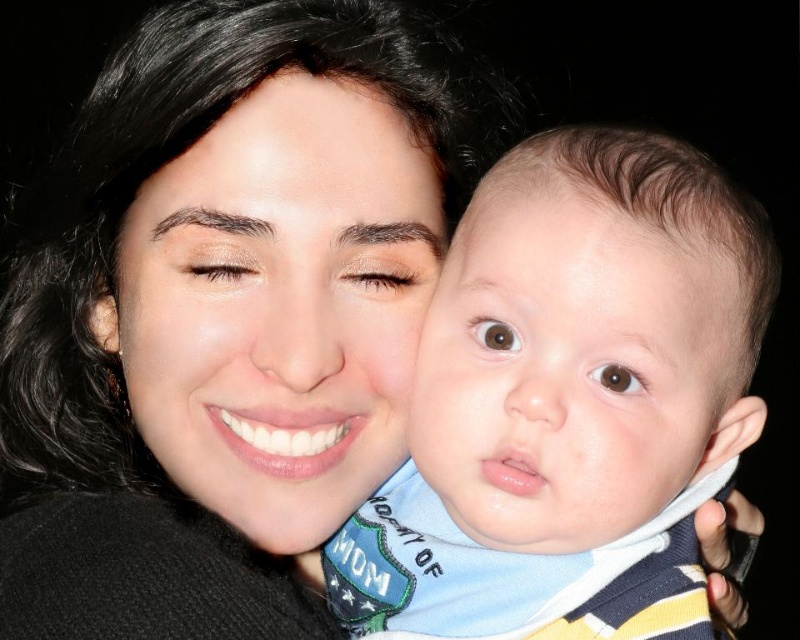
Question: Can you confirm if smooth skin baby at center is bigger than smooth skin at upper center?

Choices:
 (A) yes
 (B) no

Answer: (A)

Question: Which of the following is the farthest from the observer?

Choices:
 (A) soft blue bib at center
 (B) smooth skin baby at center
 (C) smooth skin face at center

Answer: (C)

Question: Among these points, which one is farthest from the camera?

Choices:
 (A) (370, 467)
 (B) (296, 93)
 (C) (560, 621)

Answer: (A)

Question: Which point appears farthest from the camera in this image?

Choices:
 (A) (696, 387)
 (B) (314, 136)
 (C) (624, 192)

Answer: (B)

Question: Does smooth skin face at center have a larger size compared to smooth skin at upper center?

Choices:
 (A) yes
 (B) no

Answer: (A)

Question: Can you confirm if soft blue bib at center is positioned to the right of smooth skin face at center?

Choices:
 (A) no
 (B) yes

Answer: (B)